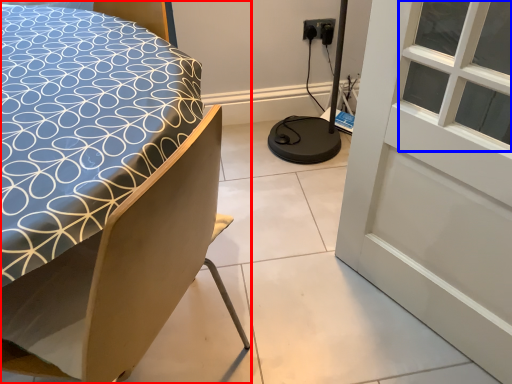
Question: Which object appears farthest to the camera in this image, bed (highlighted by a red box) or window (highlighted by a blue box)?

Choices:
 (A) bed
 (B) window

Answer: (B)